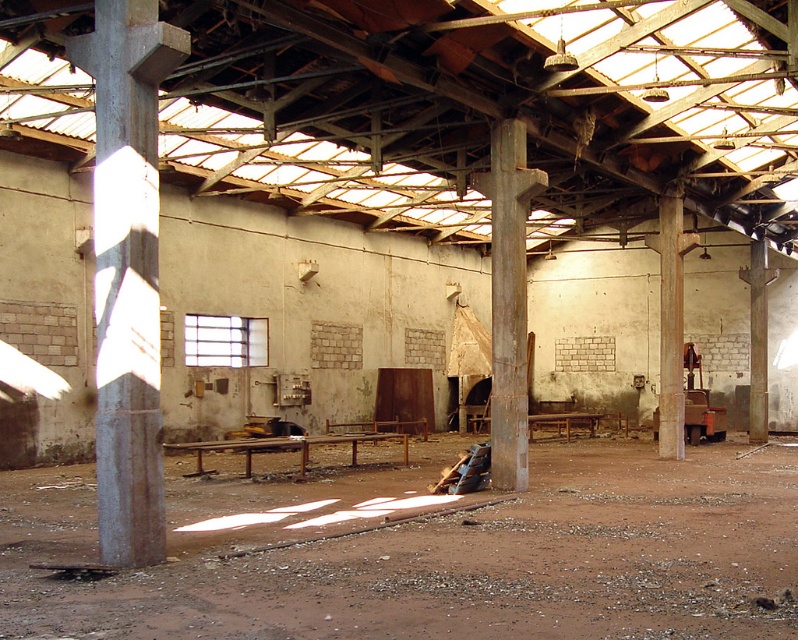
Question: Can you confirm if rusty metal pillar at center is positioned to the right of smooth concrete pillar at right?

Choices:
 (A) no
 (B) yes

Answer: (A)

Question: Among these points, which one is nearest to the camera?

Choices:
 (A) (124, 426)
 (B) (512, 163)
 (C) (682, 456)

Answer: (A)

Question: Which of the following is the farthest from the observer?

Choices:
 (A) smooth concrete pillar at right
 (B) rusty metal pillar at center

Answer: (A)

Question: Does concrete at left come behind smooth concrete pillar at right?

Choices:
 (A) yes
 (B) no

Answer: (B)

Question: Is rusty metal pillar at center positioned behind smooth concrete pillar at right?

Choices:
 (A) yes
 (B) no

Answer: (B)

Question: Which is nearer to the rusty metal pillar at center?

Choices:
 (A) smooth concrete pillar at right
 (B) concrete at left

Answer: (B)